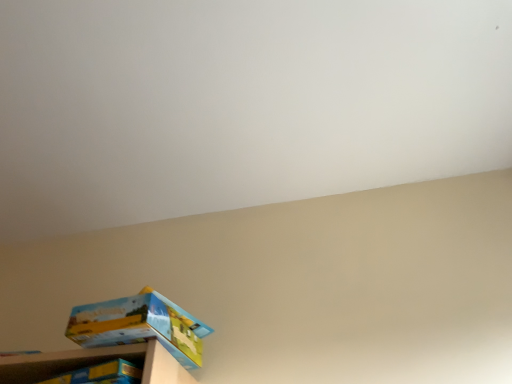
Question: Visually, is wooden shelf at lower left positioned to the left or to the right of matte cardboard box at lower left?

Choices:
 (A) right
 (B) left

Answer: (B)

Question: Is wooden shelf at lower left in front of or behind matte cardboard box at lower left in the image?

Choices:
 (A) front
 (B) behind

Answer: (A)

Question: Looking at the image, does wooden shelf at lower left seem bigger or smaller compared to matte cardboard box at lower left?

Choices:
 (A) big
 (B) small

Answer: (A)

Question: Do you think matte cardboard box at lower left is within wooden shelf at lower left, or outside of it?

Choices:
 (A) inside
 (B) outside

Answer: (B)

Question: From a real-world perspective, is matte cardboard box at lower left above or below wooden shelf at lower left?

Choices:
 (A) below
 (B) above

Answer: (B)

Question: In the image, is matte cardboard box at lower left on the left side or the right side of wooden shelf at lower left?

Choices:
 (A) left
 (B) right

Answer: (B)

Question: Is matte cardboard box at lower left bigger or smaller than wooden shelf at lower left?

Choices:
 (A) big
 (B) small

Answer: (B)